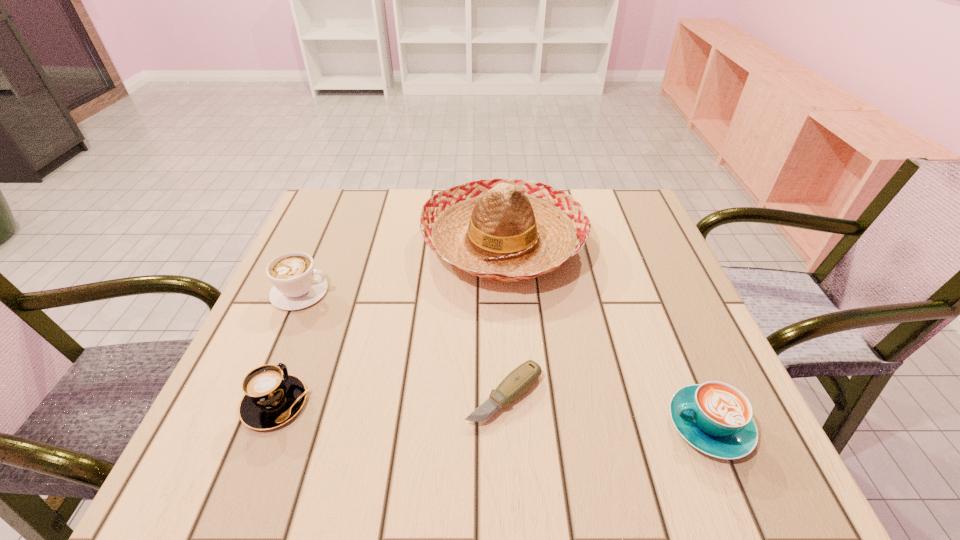
The height and width of the screenshot is (540, 960). Find the location of `sombrero`. sombrero is located at coordinates (508, 230).

Find the location of a particular element. the farthest cappuccino is located at coordinates (297, 284).

You are a GUI agent. You are given a task and a screenshot of the screen. Output one action in this format:
    pyautogui.click(x=<x>, y=<y>)
    Task: Click on the rightmost object
    
    Given the screenshot: What is the action you would take?
    pyautogui.click(x=716, y=418)

Identify the location of pocketknife. (516, 383).

Where is `free space located on the front of the sombrero`? The width and height of the screenshot is (960, 540). free space located on the front of the sombrero is located at coordinates (510, 332).

Where is `vacant point located 0.120m to the right of the farthest cappuccino's handle`? vacant point located 0.120m to the right of the farthest cappuccino's handle is located at coordinates (385, 292).

Locate an element on the screen. free space located 0.200m with the handle on the right side of the rightmost object is located at coordinates (547, 425).

Identify the location of vacant point located 0.220m with the handle on the right side of the rightmost object. The width and height of the screenshot is (960, 540). (536, 425).

Image resolution: width=960 pixels, height=540 pixels. What are the coordinates of `blank space located 0.100m with the handle on the right side of the rightmost object` in the screenshot? It's located at (608, 425).

The width and height of the screenshot is (960, 540). Identify the location of blank space located 0.280m on the left of the shortest object. (305, 395).